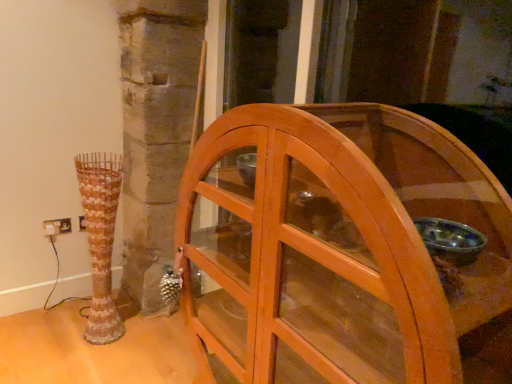
Question: From a real-world perspective, is wooden cabinet at center on top of rustic ceramic vase at left?

Choices:
 (A) yes
 (B) no

Answer: (A)

Question: Is wooden cabinet at center further to the viewer compared to rustic ceramic vase at left?

Choices:
 (A) yes
 (B) no

Answer: (B)

Question: Is wooden cabinet at center wider than rustic ceramic vase at left?

Choices:
 (A) no
 (B) yes

Answer: (B)

Question: Is wooden cabinet at center far away from rustic ceramic vase at left?

Choices:
 (A) no
 (B) yes

Answer: (B)

Question: Considering the relative sizes of wooden cabinet at center and rustic ceramic vase at left in the image provided, is wooden cabinet at center shorter than rustic ceramic vase at left?

Choices:
 (A) yes
 (B) no

Answer: (B)

Question: From the image's perspective, would you say wooden cabinet at center is positioned over rustic ceramic vase at left?

Choices:
 (A) no
 (B) yes

Answer: (A)

Question: From the image's perspective, is rustic ceramic vase at left under white plastic electric outlet at lower left?

Choices:
 (A) yes
 (B) no

Answer: (A)

Question: Is rustic ceramic vase at left placed right next to white plastic electric outlet at lower left?

Choices:
 (A) yes
 (B) no

Answer: (B)

Question: Considering the relative sizes of rustic ceramic vase at left and white plastic electric outlet at lower left in the image provided, is rustic ceramic vase at left shorter than white plastic electric outlet at lower left?

Choices:
 (A) yes
 (B) no

Answer: (B)

Question: Would you say rustic ceramic vase at left is a long distance from white plastic electric outlet at lower left?

Choices:
 (A) yes
 (B) no

Answer: (B)

Question: Can you confirm if rustic ceramic vase at left is bigger than white plastic electric outlet at lower left?

Choices:
 (A) yes
 (B) no

Answer: (A)

Question: From a real-world perspective, does rustic ceramic vase at left sit lower than white plastic electric outlet at lower left?

Choices:
 (A) no
 (B) yes

Answer: (A)

Question: Is rustic ceramic vase at left inside white plastic electric outlet at lower left?

Choices:
 (A) yes
 (B) no

Answer: (B)